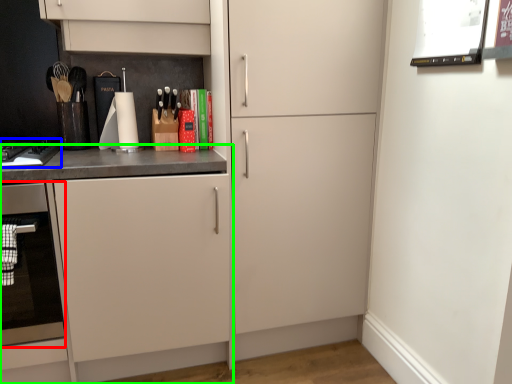
Question: Which object is positioned closest to oven (highlighted by a red box)? Select from home appliance (highlighted by a blue box) and cabinetry (highlighted by a green box).

Choices:
 (A) home appliance
 (B) cabinetry

Answer: (B)